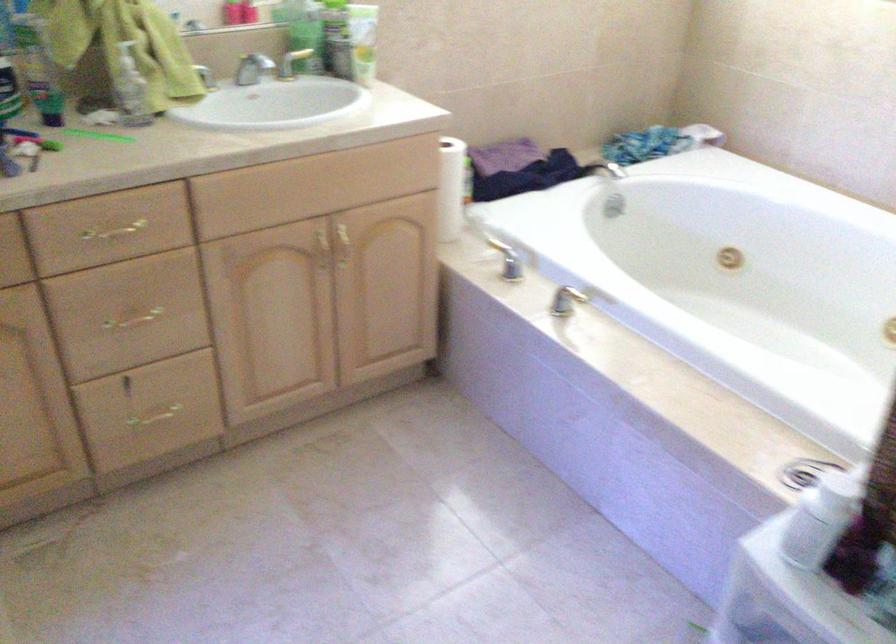
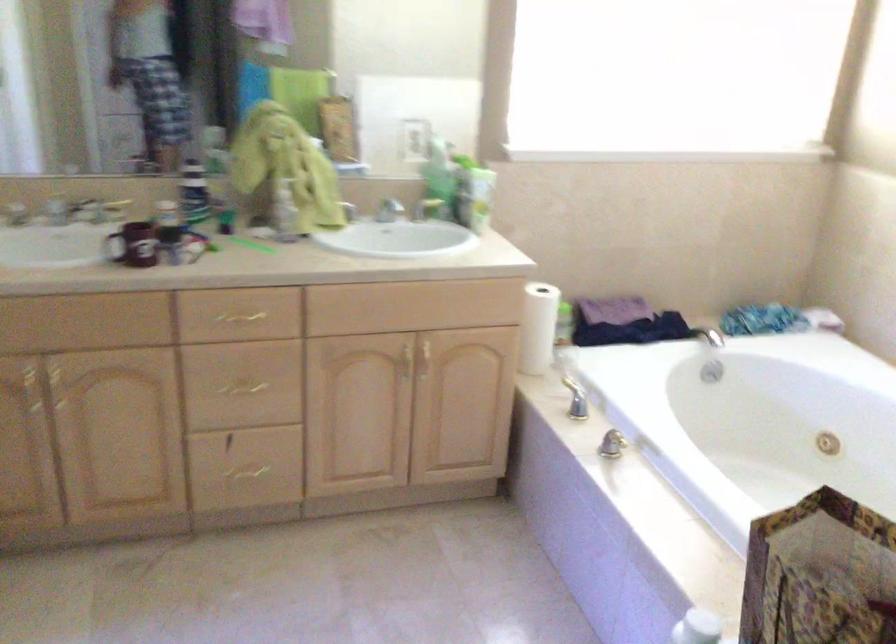
Locate, in the second image, the point that corresponds to (x=574, y=299) in the first image.

(625, 442)